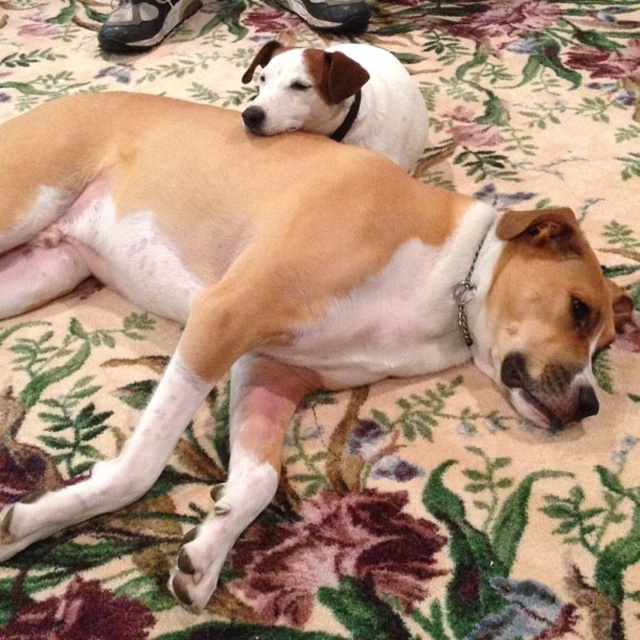
Question: Does white matte dog at upper center appear under metal chain at center?

Choices:
 (A) no
 (B) yes

Answer: (A)

Question: Is black fabric shoe at upper left bigger than black leather neckband at upper center?

Choices:
 (A) yes
 (B) no

Answer: (A)

Question: Is white matte dog at upper center in front of black leather shoe at upper center?

Choices:
 (A) no
 (B) yes

Answer: (B)

Question: Considering the real-world distances, which object is closest to the white matte dog at upper center?

Choices:
 (A) metal chain at center
 (B) black fabric shoe at upper left
 (C) black leather shoe at upper center
 (D) black leather neckband at upper center

Answer: (D)

Question: Which object appears farthest from the camera in this image?

Choices:
 (A) black leather neckband at upper center
 (B) black leather shoe at upper center
 (C) metal chain at center
 (D) white matte dog at upper center

Answer: (B)

Question: Which object is farther from the camera taking this photo?

Choices:
 (A) black leather neckband at upper center
 (B) metal chain at center
 (C) black leather shoe at upper center
 (D) white matte dog at upper center

Answer: (C)